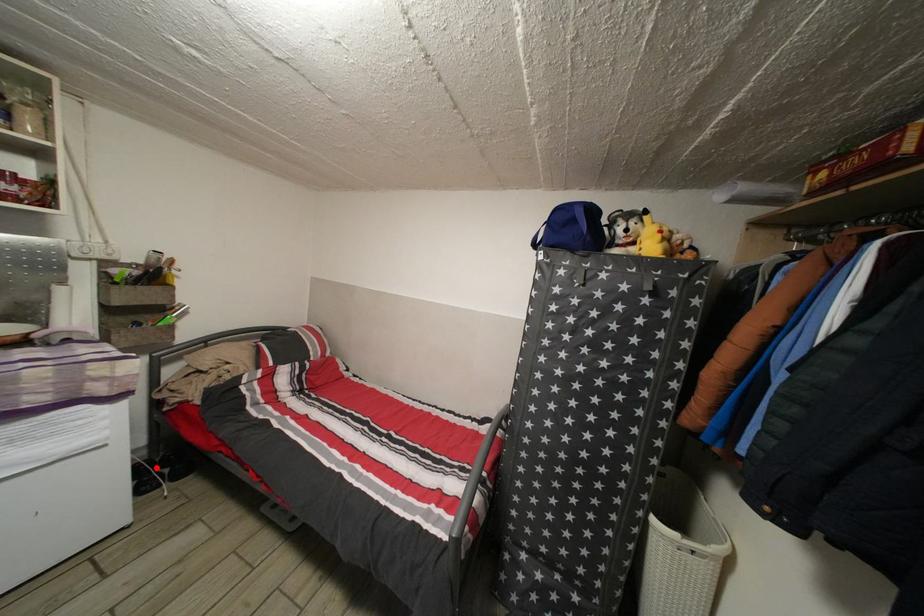
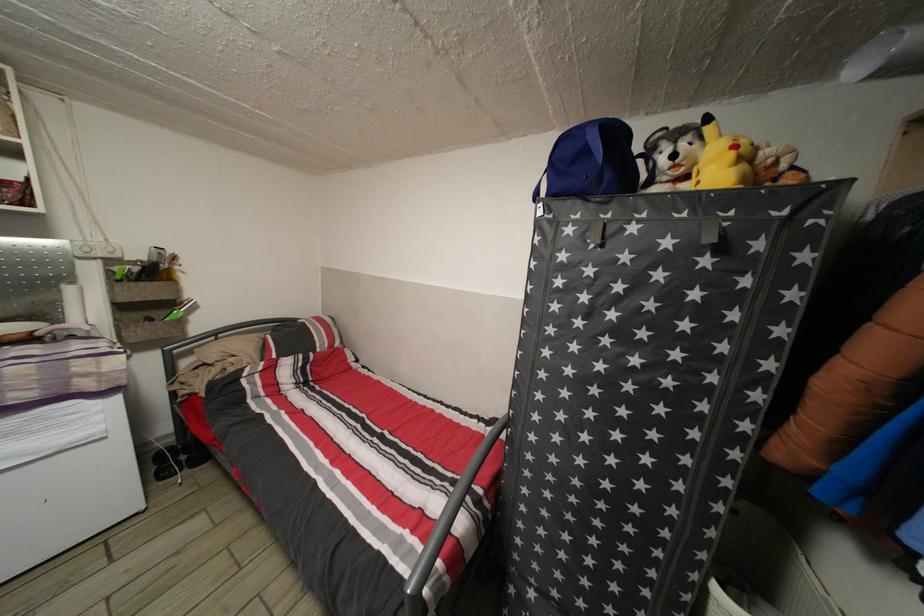
Question: I am providing you with two images of the same scene from different viewpoints. Given a red point in image1, look at the same physical point in image2. Is it:

Choices:
 (A) Closer to the viewpoint
 (B) Farther from the viewpoint

Answer: (A)